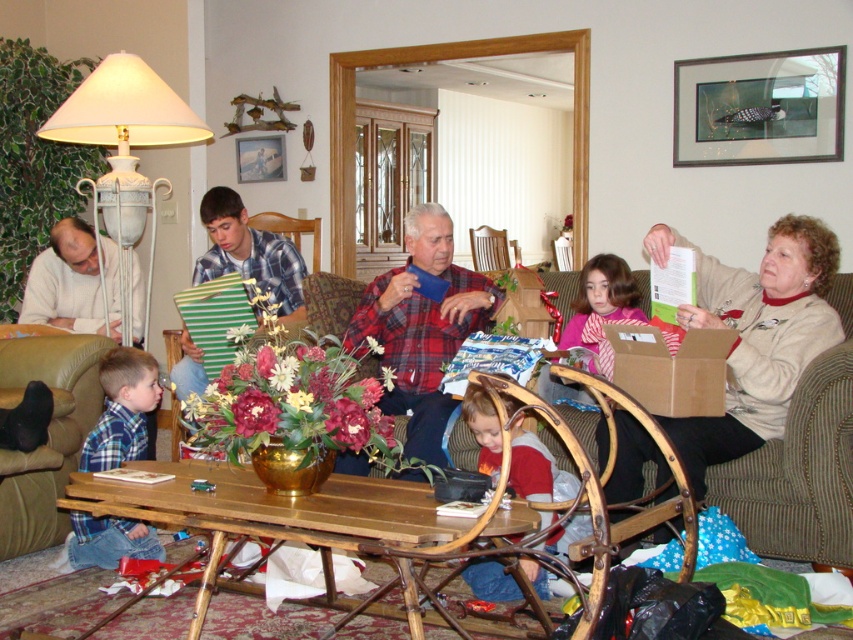
You are a guest at a family gathering and see the matte blue shirt at center and the pink satin scarf at center on the coffee table. Which item is physically nearer to you?

The matte blue shirt at center is closer to the viewer than the pink satin scarf at center, so the matte blue shirt at center is physically nearer to you.

You are a guest at a family gathering and see the matte blue shirt at center and the pink satin scarf at center on the coffee table. Which item is positioned to the right side?

The matte blue shirt at center is positioned to the right of the pink satin scarf at center.

You are a guest entering the living room and see the plaid flannel shirt at center and the brown leather couch at lower left. Which object would you encounter first as you walk into the room?

The plaid flannel shirt at center is closer to the viewer than the brown leather couch at lower left, so you would encounter the plaid flannel shirt at center first when entering the room.